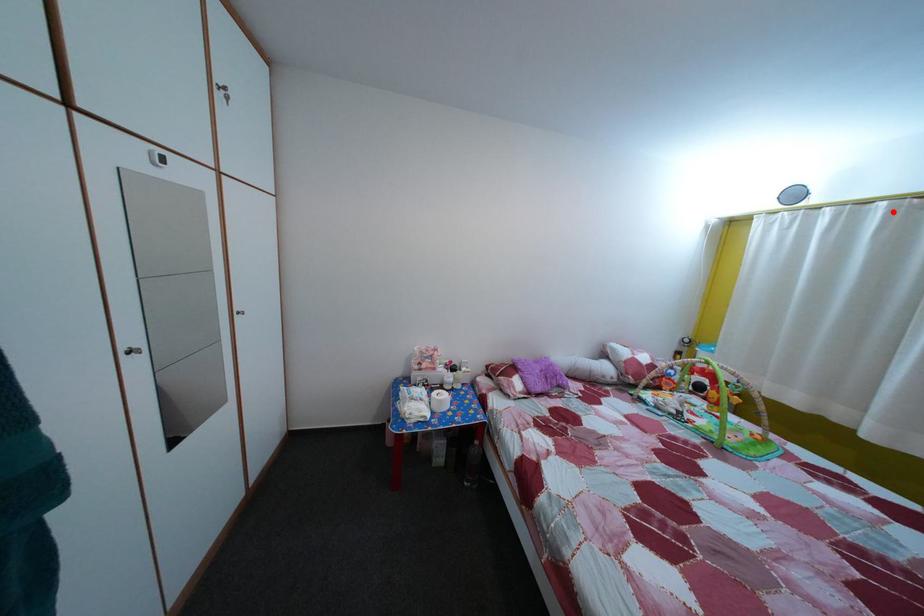
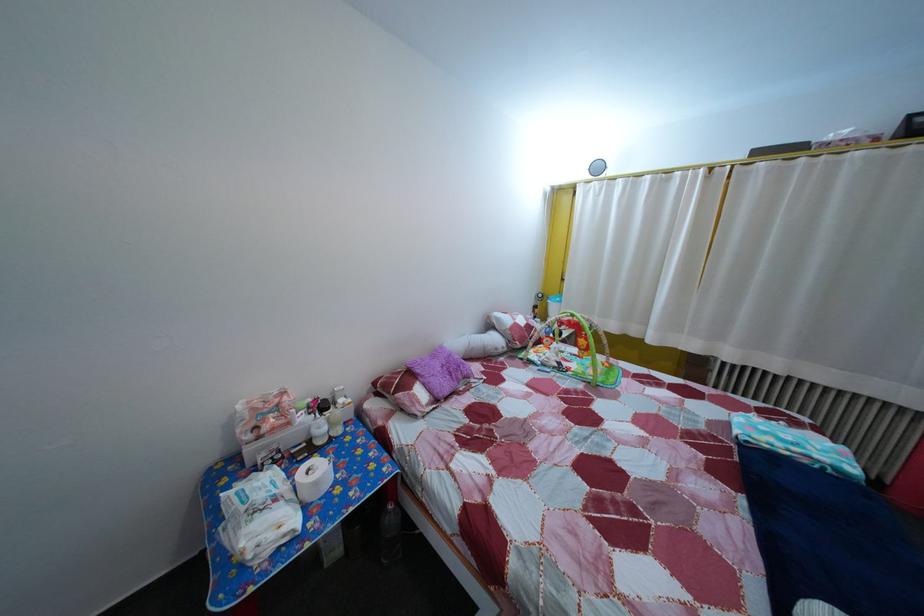
Question: I am providing you with two images of the same scene from different viewpoints. Image1 has a red point marked. In image2, the corresponding 3D location appears at what relative position? Reply with the corresponding letter.

Choices:
 (A) Closer
 (B) Farther

Answer: (A)